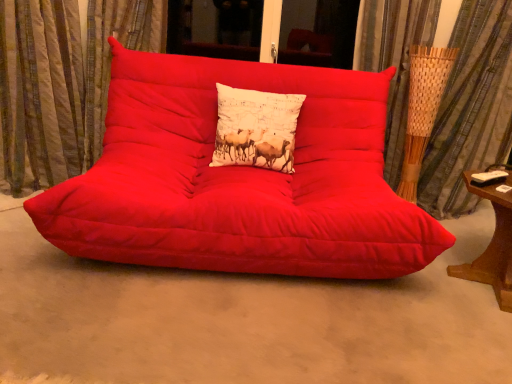
What is the approximate width of wooden side table at right?

wooden side table at right is 20.11 inches in width.

What are the coordinates of `textured beige curtain at left, marked as the second curtain in a right-to-left arrangement` in the screenshot? It's located at (62, 82).

Identify the location of woven bamboo curtain at right, the 1th curtain viewed from the right. The image size is (512, 384). pos(470,109).

This screenshot has height=384, width=512. Describe the element at coordinates (256, 128) in the screenshot. I see `white cotton cushion at center` at that location.

What is the approximate height of white cotton cushion at center?

It is 15.79 inches.

Locate an element on the screen. The image size is (512, 384). wooden side table at right is located at coordinates (492, 247).

Is wooden side table at right touching matte red studio couch at center?

No, wooden side table at right is not beside matte red studio couch at center.

Between wooden side table at right and matte red studio couch at center, which one has smaller size?

With smaller size is wooden side table at right.

Which object is wider, wooden side table at right or matte red studio couch at center?

With larger width is matte red studio couch at center.

Is wooden side table at right taller or shorter than matte red studio couch at center?

Clearly, wooden side table at right is shorter compared to matte red studio couch at center.

Is woven bamboo curtain at right, the second curtain when ordered from left to right, aimed at matte red studio couch at center?

Yes.

Is woven bamboo curtain at right, the second curtain when ordered from left to right, with matte red studio couch at center?

No, woven bamboo curtain at right, the second curtain when ordered from left to right, is not touching matte red studio couch at center.

From a real-world perspective, who is located higher, woven bamboo curtain at right, the second curtain when ordered from left to right, or matte red studio couch at center?

woven bamboo curtain at right, the second curtain when ordered from left to right, is physically above.

Is woven bamboo curtain at right, the second curtain when ordered from left to right, completely or partially outside of matte red studio couch at center?

Absolutely, woven bamboo curtain at right, the second curtain when ordered from left to right, is external to matte red studio couch at center.

Where is `curtain on the right of the white cotton cushion at center`? curtain on the right of the white cotton cushion at center is located at coordinates (470, 109).

Is white cotton cushion at center positioned in front of woven bamboo curtain at right, the 1th curtain viewed from the right?

Yes.

Which is in front, point (280, 167) or point (456, 123)?

The point (280, 167) is in front.

From the picture: From the image's perspective, who appears lower, matte red studio couch at center or woven bamboo curtain at right, the second curtain when ordered from left to right?

matte red studio couch at center, from the image's perspective.

Is matte red studio couch at center to the right of woven bamboo curtain at right, the 1th curtain viewed from the right, from the viewer's perspective?

No, matte red studio couch at center is not to the right of woven bamboo curtain at right, the 1th curtain viewed from the right.

From a real-world perspective, relative to woven bamboo curtain at right, the second curtain when ordered from left to right, is matte red studio couch at center vertically above or below?

matte red studio couch at center is below woven bamboo curtain at right, the second curtain when ordered from left to right.

Does point (336, 261) come behind point (471, 210)?

No.

Is wooden side table at right placed right next to matte red futon at center?

No, wooden side table at right is not in contact with matte red futon at center.

Can you confirm if wooden side table at right is thinner than matte red futon at center?

Indeed, wooden side table at right has a lesser width compared to matte red futon at center.

Is wooden side table at right outside of matte red futon at center?

Yes, wooden side table at right is outside of matte red futon at center.

From the image's perspective, is woven bamboo curtain at right, the second curtain when ordered from left to right, above or below white cotton cushion at center?

Clearly, from the image's perspective, woven bamboo curtain at right, the second curtain when ordered from left to right, is above white cotton cushion at center.

Is woven bamboo curtain at right, the second curtain when ordered from left to right, not inside white cotton cushion at center?

Yes, woven bamboo curtain at right, the second curtain when ordered from left to right, is not within white cotton cushion at center.

Based on the photo, is woven bamboo curtain at right, the second curtain when ordered from left to right, facing away from white cotton cushion at center?

No, woven bamboo curtain at right, the second curtain when ordered from left to right, is not facing the opposite direction of white cotton cushion at center.

Is woven bamboo curtain at right, the 1th curtain viewed from the right, wider than white cotton cushion at center?

Indeed, woven bamboo curtain at right, the 1th curtain viewed from the right, has a greater width compared to white cotton cushion at center.

Is matte red studio couch at center far from matte red futon at center?

No, there isn't a large distance between matte red studio couch at center and matte red futon at center.

Based on their sizes in the image, would you say matte red studio couch at center is bigger or smaller than matte red futon at center?

matte red studio couch at center is bigger than matte red futon at center.

Can you tell me how much matte red studio couch at center and matte red futon at center differ in facing direction?

The facing directions of matte red studio couch at center and matte red futon at center are 4.82 degrees apart.

Considering the sizes of matte red studio couch at center and matte red futon at center in the image, is matte red studio couch at center taller or shorter than matte red futon at center?

matte red studio couch at center is taller than matte red futon at center.

Locate an element on the screen. The image size is (512, 384). table below the matte red studio couch at center (from the image's perspective) is located at coordinates (492, 247).

This screenshot has width=512, height=384. What are the coordinates of `studio couch in front of the woven bamboo curtain at right, the 1th curtain viewed from the right` in the screenshot? It's located at (239, 179).

Estimate the real-world distances between objects in this image. Which object is closer to wooden side table at right, white cotton cushion at center or woven bamboo curtain at right, the 1th curtain viewed from the right?

woven bamboo curtain at right, the 1th curtain viewed from the right, is closer to wooden side table at right.

Looking at the image, which one is located further to matte red studio couch at center, wooden side table at right or white cotton cushion at center?

Among the two, wooden side table at right is located further to matte red studio couch at center.

When comparing their distances from woven bamboo curtain at right, the 1th curtain viewed from the right, does textured beige curtain at left, marked as the second curtain in a right-to-left arrangement, or matte red futon at center seem further?

textured beige curtain at left, marked as the second curtain in a right-to-left arrangement, is further to woven bamboo curtain at right, the 1th curtain viewed from the right.

Based on their spatial positions, is textured beige curtain at left, marked as the second curtain in a right-to-left arrangement, or matte red futon at center closer to matte red studio couch at center?

matte red futon at center is closer to matte red studio couch at center.

Looking at the image, which one is located closer to wooden side table at right, woven bamboo curtain at right, the second curtain when ordered from left to right, or matte red futon at center?

The object closer to wooden side table at right is matte red futon at center.

Estimate the real-world distances between objects in this image. Which object is closer to white cotton cushion at center, wooden side table at right or woven bamboo curtain at right, the second curtain when ordered from left to right?

woven bamboo curtain at right, the second curtain when ordered from left to right, is positioned closer to the anchor white cotton cushion at center.

Estimate the real-world distances between objects in this image. Which object is closer to woven bamboo curtain at right, the 1th curtain viewed from the right, matte red futon at center or wooden side table at right?

The object closer to woven bamboo curtain at right, the 1th curtain viewed from the right, is wooden side table at right.

When comparing their distances from matte red studio couch at center, does matte red futon at center or textured beige curtain at left, which ranks as the 1th curtain in left-to-right order, seem further?

textured beige curtain at left, which ranks as the 1th curtain in left-to-right order, is positioned further to the anchor matte red studio couch at center.

Locate an element on the screen. Image resolution: width=512 pixels, height=384 pixels. concrete between textured beige curtain at left, marked as the second curtain in a right-to-left arrangement, and woven bamboo curtain at right, the second curtain when ordered from left to right, from left to right is located at coordinates (245, 320).

Where is `pillow located between matte red studio couch at center and wooden side table at right in the left-right direction`? pillow located between matte red studio couch at center and wooden side table at right in the left-right direction is located at coordinates (256, 128).

Where is `table situated between white cotton cushion at center and woven bamboo curtain at right, the second curtain when ordered from left to right, from left to right`? The width and height of the screenshot is (512, 384). table situated between white cotton cushion at center and woven bamboo curtain at right, the second curtain when ordered from left to right, from left to right is located at coordinates (492, 247).

Where is `studio couch between matte red futon at center and white cotton cushion at center in the front-back direction`? This screenshot has width=512, height=384. studio couch between matte red futon at center and white cotton cushion at center in the front-back direction is located at coordinates (239, 179).